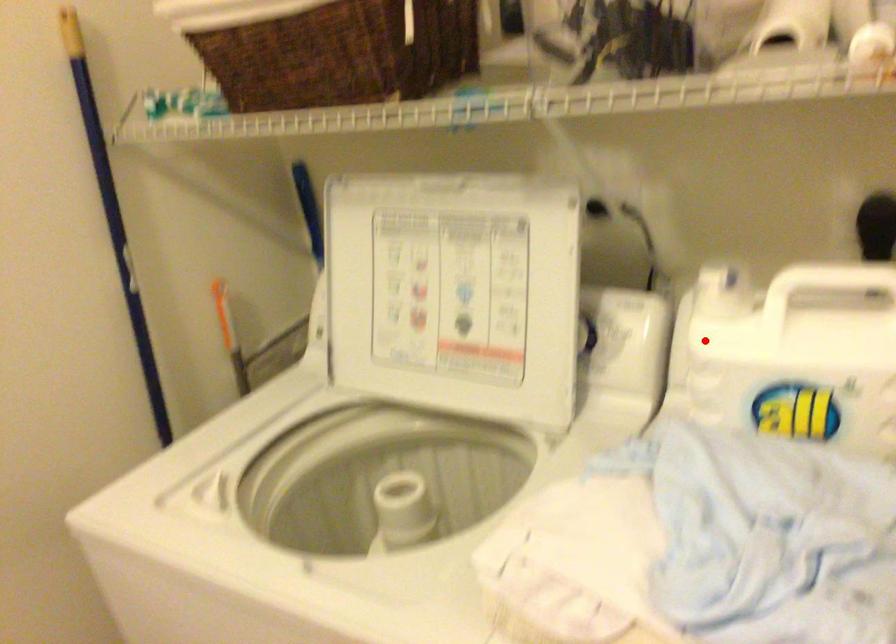
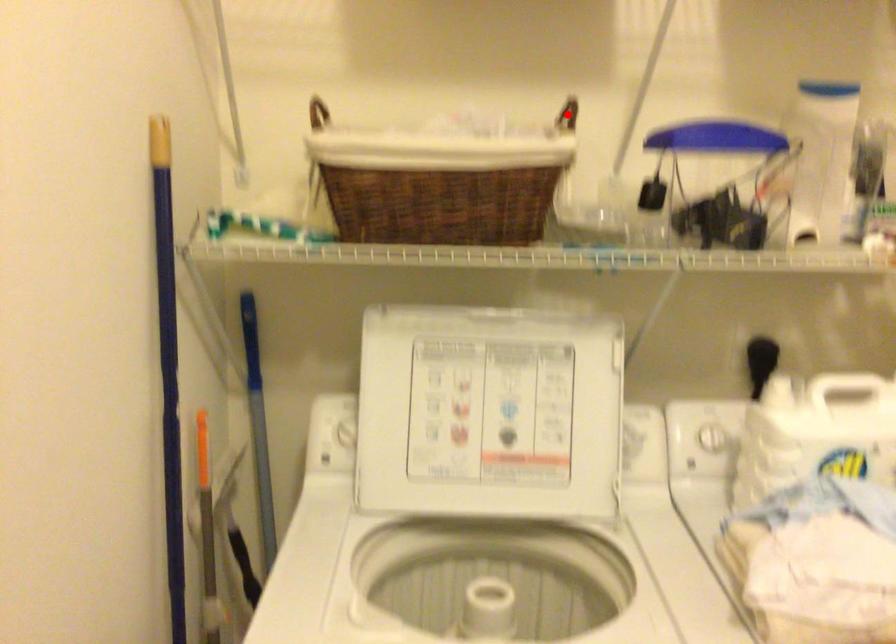
I am providing you with two images of the same scene from different viewpoints. A red point is marked on the first image and another point is marked on the second image. Are the points marked in image1 and image2 representing the same 3D position?

No